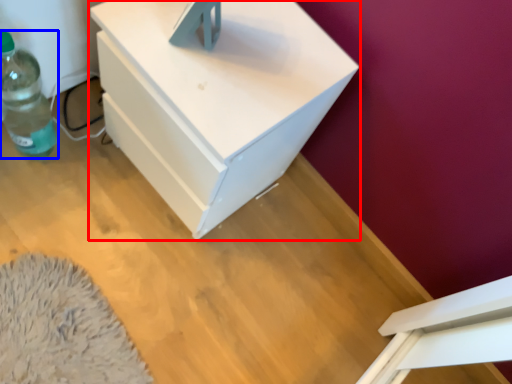
Question: Among these objects, which one is nearest to the camera, nightstand (highlighted by a red box) or bottle (highlighted by a blue box)?

Choices:
 (A) nightstand
 (B) bottle

Answer: (A)